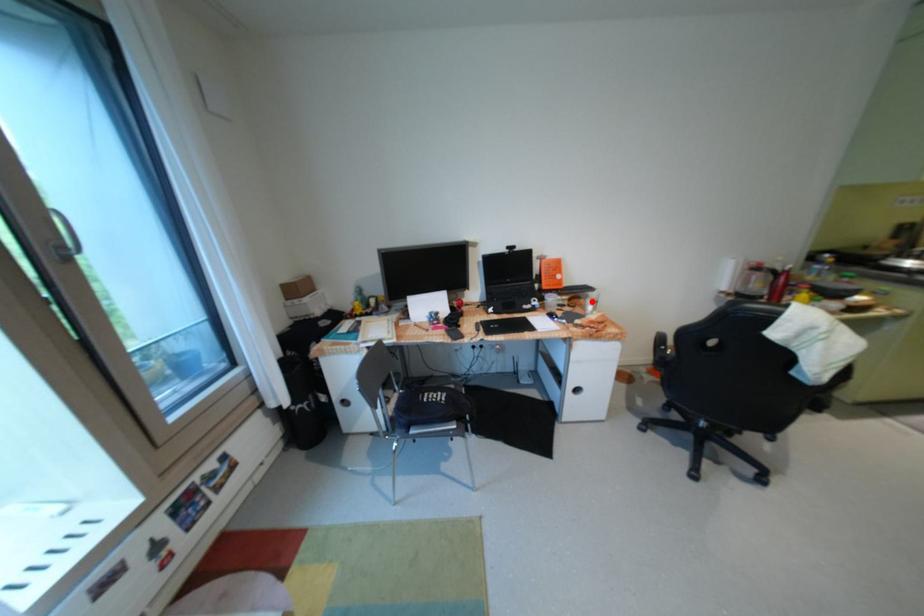
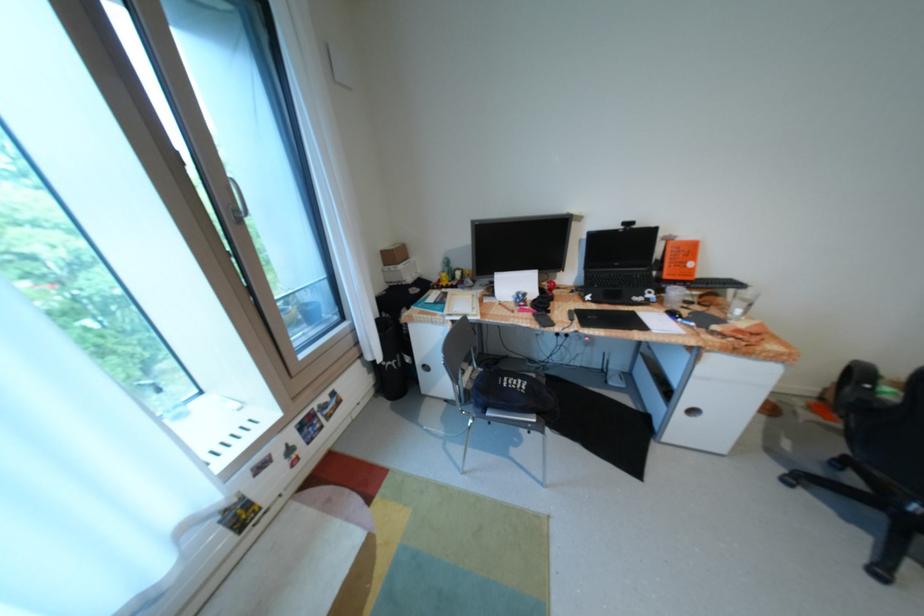
In the second image, find the point that corresponds to the highlighted location in the first image.

(731, 301)